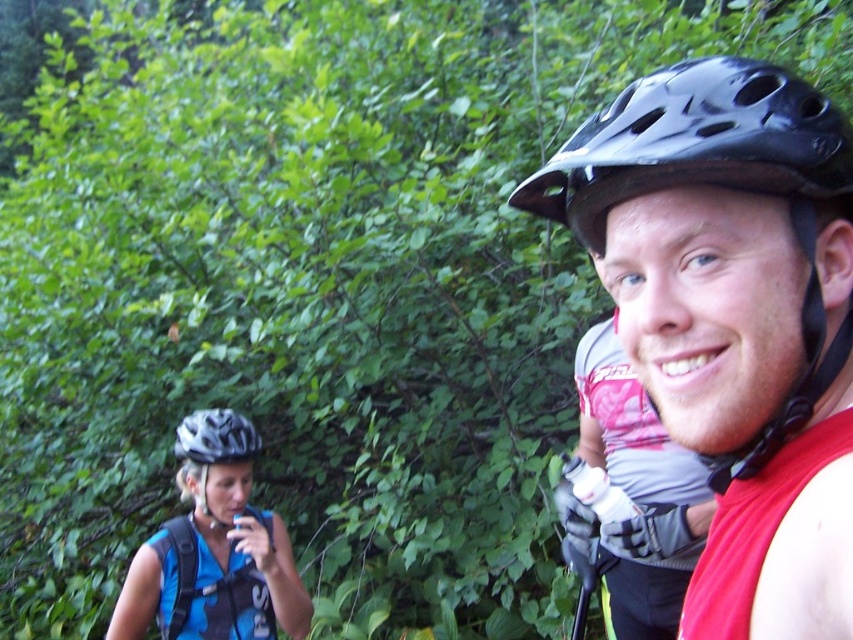
Who is lower down, black glossy bicycle helmet at upper right or blue matte helmet at left?

Positioned lower is blue matte helmet at left.

Is black glossy bicycle helmet at upper right positioned at the back of blue matte helmet at left?

That is False.

Locate an element on the screen. The height and width of the screenshot is (640, 853). black glossy bicycle helmet at upper right is located at coordinates (695, 144).

Locate an element on the screen. black glossy bicycle helmet at upper right is located at coordinates coord(695,144).

In the scene shown: Is blue matte helmet at left thinner than matte black helmet at left?

No.

Does blue matte helmet at left have a greater width compared to matte black helmet at left?

Indeed, blue matte helmet at left has a greater width compared to matte black helmet at left.

This screenshot has width=853, height=640. Find the location of `blue matte helmet at left`. blue matte helmet at left is located at coordinates (213, 548).

Is point (286, 589) more distant than point (212, 412)?

No, (286, 589) is closer to viewer.

Is the position of blue matte helmet at left less distant than that of white matte bicycle helmet at left?

Yes, blue matte helmet at left is in front of white matte bicycle helmet at left.

The image size is (853, 640). Find the location of `blue matte helmet at left`. blue matte helmet at left is located at coordinates (213, 548).